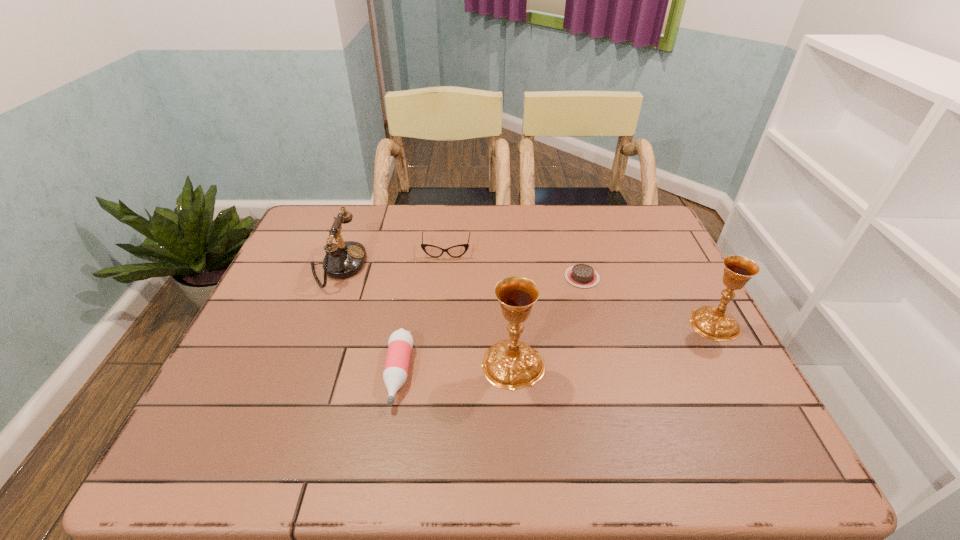
At what (x,y) coordinates should I click in order to perform the action: click on free space between the bottle and the spectacles. Please return your answer as a coordinate pair (x, y). The height and width of the screenshot is (540, 960). Looking at the image, I should click on (422, 312).

Where is `free space between the bottle and the spectacles`? free space between the bottle and the spectacles is located at coordinates (422, 312).

At what (x,y) coordinates should I click in order to perform the action: click on vacant space in between the left chalice and the bottle. Please return your answer as a coordinate pair (x, y). The image size is (960, 540). Looking at the image, I should click on (456, 369).

You are a GUI agent. You are given a task and a screenshot of the screen. Output one action in this format:
    pyautogui.click(x=<x>, y=<y>)
    Task: Click on the free area in between the fifth shortest object and the bottle
    The image size is (960, 540).
    Given the screenshot: What is the action you would take?
    pyautogui.click(x=556, y=348)

In order to click on vacant area that lies between the second tallest object and the taller chalice in this screenshot , I will do `click(613, 344)`.

Image resolution: width=960 pixels, height=540 pixels. What are the coordinates of `free spot between the spectacles and the tallest object` in the screenshot? It's located at (480, 308).

At what (x,y) coordinates should I click in order to perform the action: click on empty location between the spectacles and the tallest object. Please return your answer as a coordinate pair (x, y). Looking at the image, I should click on (480, 308).

Image resolution: width=960 pixels, height=540 pixels. Identify the location of vacant point located between the second tallest object and the bottle. (556, 348).

Locate an element on the screen. empty space between the tallest object and the second tallest object is located at coordinates (613, 344).

Locate an element on the screen. The width and height of the screenshot is (960, 540). the fifth closest object to the leftmost object is located at coordinates (711, 322).